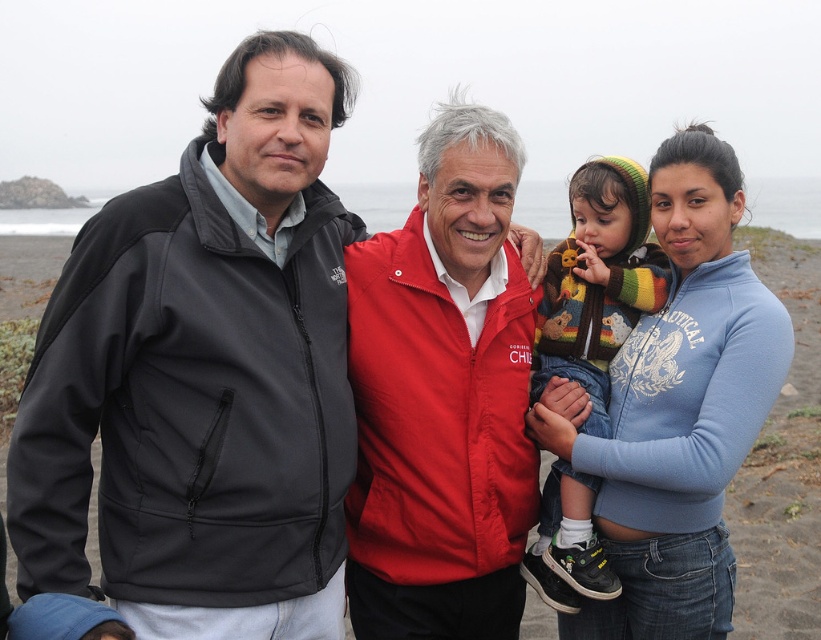
You are a photographer trying to capture a group photo of the matte black jacket at left and the blue fleece jacket at center. Since you want to ensure both subjects are in focus, you need to know which jacket is larger to adjust your camera settings accordingly. Which jacket is larger?

The matte black jacket at left is bigger than the blue fleece jacket at center, so you should adjust your camera settings to focus on the larger matte black jacket at left.

You are a photographer trying to capture the group of people in the image. You need to focus your camera on the red matte jacket at center. What are the coordinates where you should aim your camera?

The coordinates for the red matte jacket at center are at point (443, 397).

You are trying to decide which clothing item to take for a windy day based on their sizes. The blue fleece jacket at center and the knitted wool sweater at center are both in your options. Which one has a larger width and would provide more coverage?

The blue fleece jacket at center has a larger width than the knitted wool sweater at center, so it would provide more coverage.